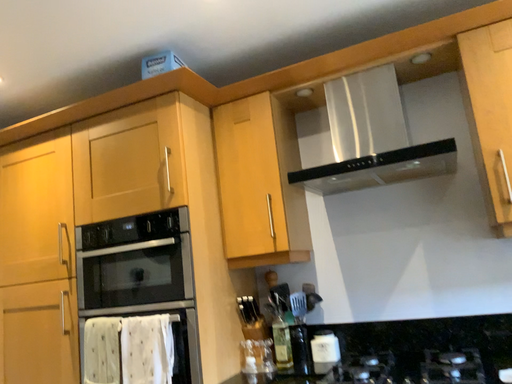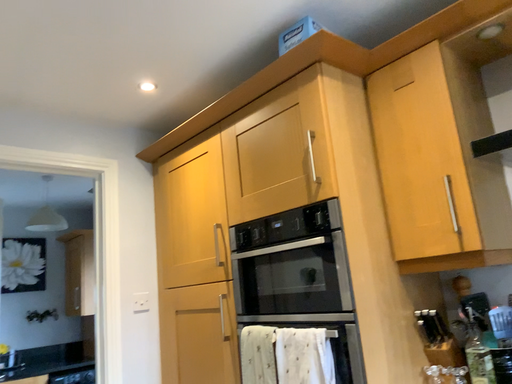
Question: How did the camera likely rotate when shooting the video?

Choices:
 (A) rotated right
 (B) rotated left

Answer: (B)